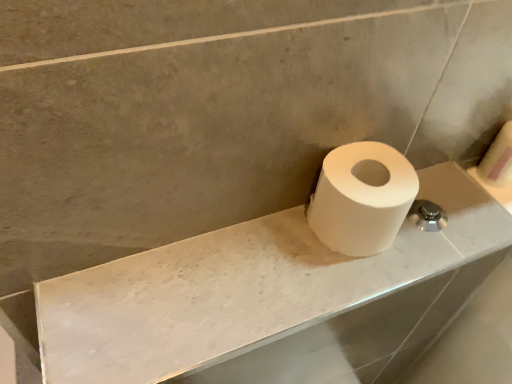
Find the location of a particular element. The height and width of the screenshot is (384, 512). white marble counter top at center is located at coordinates (273, 300).

What do you see at coordinates (498, 159) in the screenshot?
I see `white matte toilet paper at right, the second toilet paper from the front` at bounding box center [498, 159].

At what (x,y) coordinates should I click in order to perform the action: click on white matte toilet paper at right, which is the 1th toilet paper from front to back. Please return your answer as a coordinate pair (x, y). The image size is (512, 384). Looking at the image, I should click on (361, 199).

At what (x,y) coordinates should I click in order to perform the action: click on white marble counter top at center. Please return your answer as a coordinate pair (x, y). The width and height of the screenshot is (512, 384). Looking at the image, I should click on (273, 300).

Is white marble counter top at center to the right of white matte toilet paper at right, which ranks as the first toilet paper in left-to-right order, from the viewer's perspective?

No.

Is white matte toilet paper at right, which is the 1th toilet paper from front to back, inside white marble counter top at center?

No.

Is white marble counter top at center further to the viewer compared to white matte toilet paper at right, which ranks as the first toilet paper in left-to-right order?

No.

From the image's perspective, who appears lower, white matte toilet paper at right, positioned as the 2th toilet paper in back-to-front order, or white matte toilet paper at right, the second toilet paper from the front?

white matte toilet paper at right, positioned as the 2th toilet paper in back-to-front order, is shown below in the image.

Is white matte toilet paper at right, the second toilet paper from the right, taller than white matte toilet paper at right, the first toilet paper from the right?

Incorrect, the height of white matte toilet paper at right, the second toilet paper from the right, is not larger of that of white matte toilet paper at right, the first toilet paper from the right.

From a real-world perspective, between white matte toilet paper at right, which ranks as the first toilet paper in left-to-right order, and white matte toilet paper at right, the first toilet paper from the right, who is vertically lower?

white matte toilet paper at right, the first toilet paper from the right, from a real-world perspective.

Is white matte toilet paper at right, which ranks as the first toilet paper in left-to-right order, situated inside white matte toilet paper at right, the second toilet paper from the front, or outside?

white matte toilet paper at right, which ranks as the first toilet paper in left-to-right order, is located beyond the bounds of white matte toilet paper at right, the second toilet paper from the front.

In terms of height, does white matte toilet paper at right, the second toilet paper positioned from the left, look taller or shorter compared to white marble counter top at center?

white matte toilet paper at right, the second toilet paper positioned from the left, is taller than white marble counter top at center.

Looking at this image, is white matte toilet paper at right, the second toilet paper from the front, turned away from white marble counter top at center?

That's not correct — white matte toilet paper at right, the second toilet paper from the front, is not looking away from white marble counter top at center.

Would you say white matte toilet paper at right, the second toilet paper from the front, is outside white marble counter top at center?

Yes, white matte toilet paper at right, the second toilet paper from the front, is outside of white marble counter top at center.

Between point (478, 168) and point (209, 276), which one is positioned in front?

The point (209, 276) is closer to the camera.

Considering the sizes of objects white marble counter top at center and white matte toilet paper at right, the second toilet paper positioned from the left, in the image provided, who is shorter, white marble counter top at center or white matte toilet paper at right, the second toilet paper positioned from the left,?

Standing shorter between the two is white marble counter top at center.

Measure the distance between white marble counter top at center and white matte toilet paper at right, the 1th toilet paper positioned from the back.

The distance of white marble counter top at center from white matte toilet paper at right, the 1th toilet paper positioned from the back, is 14.85 inches.

Is white matte toilet paper at right, the second toilet paper positioned from the left, located within white marble counter top at center?

Actually, white matte toilet paper at right, the second toilet paper positioned from the left, is outside white marble counter top at center.

From the image's perspective, which is above, white marble counter top at center or white matte toilet paper at right, the 1th toilet paper positioned from the back?

white matte toilet paper at right, the 1th toilet paper positioned from the back, is shown above in the image.

Which of these two, white matte toilet paper at right, which ranks as the first toilet paper in left-to-right order, or white marble counter top at center, stands taller?

With more height is white matte toilet paper at right, which ranks as the first toilet paper in left-to-right order.

Is white matte toilet paper at right, which ranks as the first toilet paper in left-to-right order, at the left side of white marble counter top at center?

No, white matte toilet paper at right, which ranks as the first toilet paper in left-to-right order, is not to the left of white marble counter top at center.

Does white matte toilet paper at right, the second toilet paper positioned from the left, have a larger size compared to white matte toilet paper at right, the second toilet paper from the right?

No, white matte toilet paper at right, the second toilet paper positioned from the left, is not bigger than white matte toilet paper at right, the second toilet paper from the right.

Could you tell me if white matte toilet paper at right, the first toilet paper from the right, is facing white matte toilet paper at right, which is the 1th toilet paper from front to back?

No, white matte toilet paper at right, the first toilet paper from the right, is not aimed at white matte toilet paper at right, which is the 1th toilet paper from front to back.

Locate an element on the screen. This screenshot has height=384, width=512. toilet paper above the white matte toilet paper at right, the second toilet paper positioned from the left (from a real-world perspective) is located at coordinates (361, 199).

Where is `toilet paper that is the 1st object located above the white marble counter top at center (from the image's perspective)`? toilet paper that is the 1st object located above the white marble counter top at center (from the image's perspective) is located at coordinates (361, 199).

Find the location of a particular element. This screenshot has height=384, width=512. toilet paper that is below the white matte toilet paper at right, the second toilet paper from the front (from the image's perspective) is located at coordinates (361, 199).

Estimate the real-world distances between objects in this image. Which object is further from white marble counter top at center, white matte toilet paper at right, the second toilet paper from the right, or white matte toilet paper at right, the second toilet paper positioned from the left?

Among the two, white matte toilet paper at right, the second toilet paper positioned from the left, is located further to white marble counter top at center.

Estimate the real-world distances between objects in this image. Which object is closer to white marble counter top at center, white matte toilet paper at right, the first toilet paper from the right, or white matte toilet paper at right, the second toilet paper from the right?

white matte toilet paper at right, the second toilet paper from the right, is positioned closer to the anchor white marble counter top at center.

When comparing their distances from white matte toilet paper at right, the first toilet paper from the right, does white marble counter top at center or white matte toilet paper at right, the second toilet paper from the right, seem closer?

white matte toilet paper at right, the second toilet paper from the right, lies closer to white matte toilet paper at right, the first toilet paper from the right, than the other object.

Considering their positions, is white marble counter top at center positioned closer to white matte toilet paper at right, the second toilet paper from the right, than white matte toilet paper at right, the second toilet paper positioned from the left?

white marble counter top at center lies closer to white matte toilet paper at right, the second toilet paper from the right, than the other object.

Which object lies further to the anchor point white matte toilet paper at right, the 1th toilet paper positioned from the back, white matte toilet paper at right, which ranks as the first toilet paper in left-to-right order, or white marble counter top at center?

white marble counter top at center lies further to white matte toilet paper at right, the 1th toilet paper positioned from the back, than the other object.

Estimate the real-world distances between objects in this image. Which object is closer to white matte toilet paper at right, which is the 1th toilet paper from front to back, white matte toilet paper at right, the 1th toilet paper positioned from the back, or white marble counter top at center?

Based on the image, white marble counter top at center appears to be nearer to white matte toilet paper at right, which is the 1th toilet paper from front to back.

Locate an element on the screen. Image resolution: width=512 pixels, height=384 pixels. toilet paper between white marble counter top at center and white matte toilet paper at right, the second toilet paper from the front, in the horizontal direction is located at coordinates point(361,199).